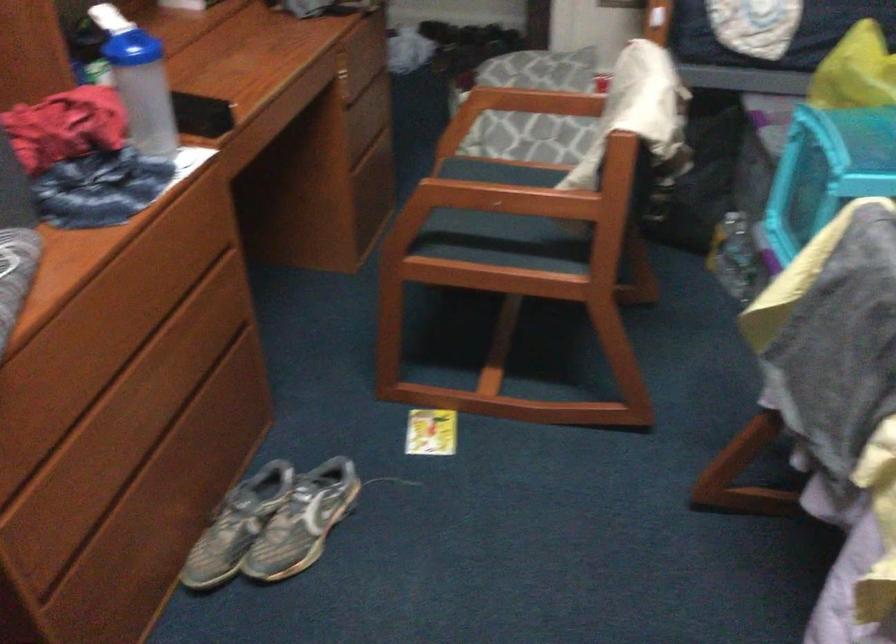
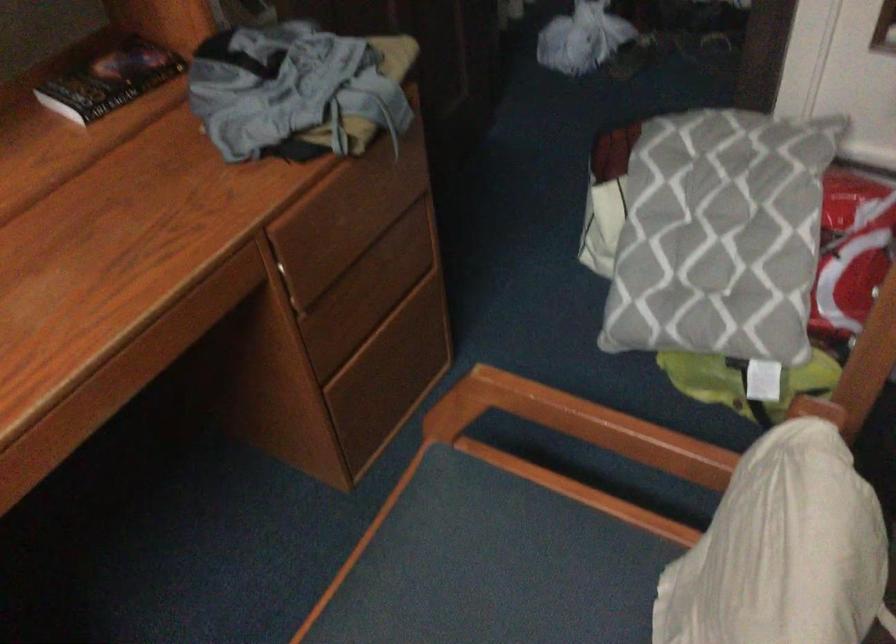
In the second image, find the point that corresponds to pixel 347 75 in the first image.

(299, 276)